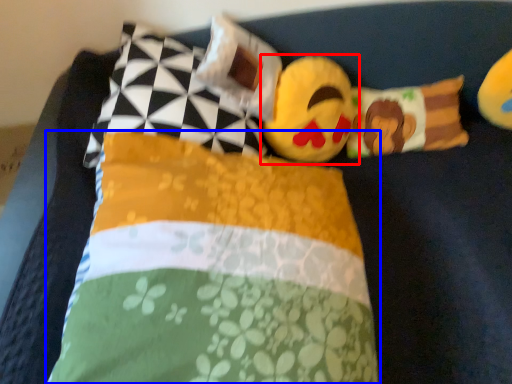
Question: Which object appears farthest to the camera in this image, toy (highlighted by a red box) or pillow (highlighted by a blue box)?

Choices:
 (A) toy
 (B) pillow

Answer: (A)